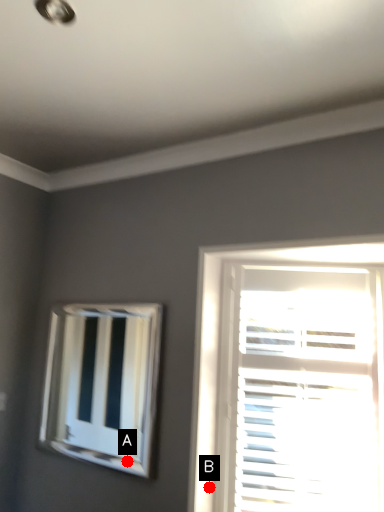
Question: Two points are circled on the image, labeled by A and B beside each circle. Which point is closer to the camera taking this photo?

Choices:
 (A) A is closer
 (B) B is closer

Answer: (B)